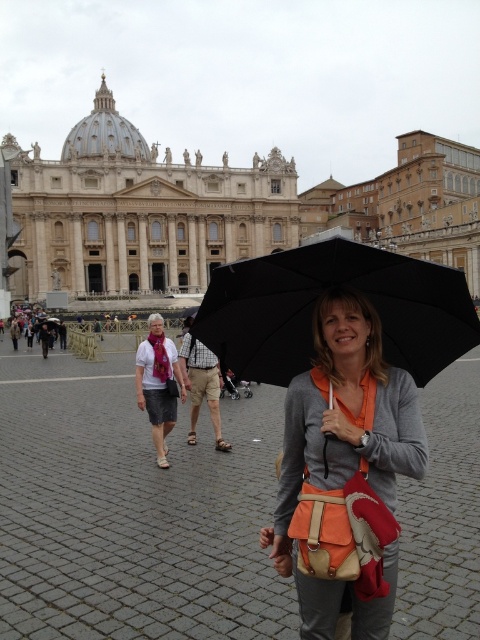
Who is higher up, orange fabric umbrella at center or matte white shirt at center?

matte white shirt at center

Does orange fabric umbrella at center have a lesser width compared to matte white shirt at center?

Incorrect, orange fabric umbrella at center's width is not less than matte white shirt at center's.

Where is `orange fabric umbrella at center`? The width and height of the screenshot is (480, 640). orange fabric umbrella at center is located at coordinates (132, 512).

Where is `orange fabric umbrella at center`? The height and width of the screenshot is (640, 480). orange fabric umbrella at center is located at coordinates (132, 512).

Does orange fabric umbrella at center appear over white marble palace at upper center?

No, orange fabric umbrella at center is not above white marble palace at upper center.

Which is more to the right, orange fabric umbrella at center or white marble palace at upper center?

orange fabric umbrella at center is more to the right.

Measure the distance between orange fabric umbrella at center and camera.

orange fabric umbrella at center is 41.06 meters away from camera.

This screenshot has width=480, height=640. Identify the location of orange fabric umbrella at center. (132, 512).

Which of these two, orange fabric umbrella at center or matte orange bag at center, stands taller?

With more height is matte orange bag at center.

Is the position of orange fabric umbrella at center less distant than that of matte orange bag at center?

That is False.

Between point (120, 612) and point (300, 400), which one is positioned in front?

Positioned in front is point (120, 612).

At what (x,y) coordinates should I click in order to perform the action: click on orange fabric umbrella at center. Please return your answer as a coordinate pair (x, y). Image resolution: width=480 pixels, height=640 pixels. Looking at the image, I should click on (132, 512).